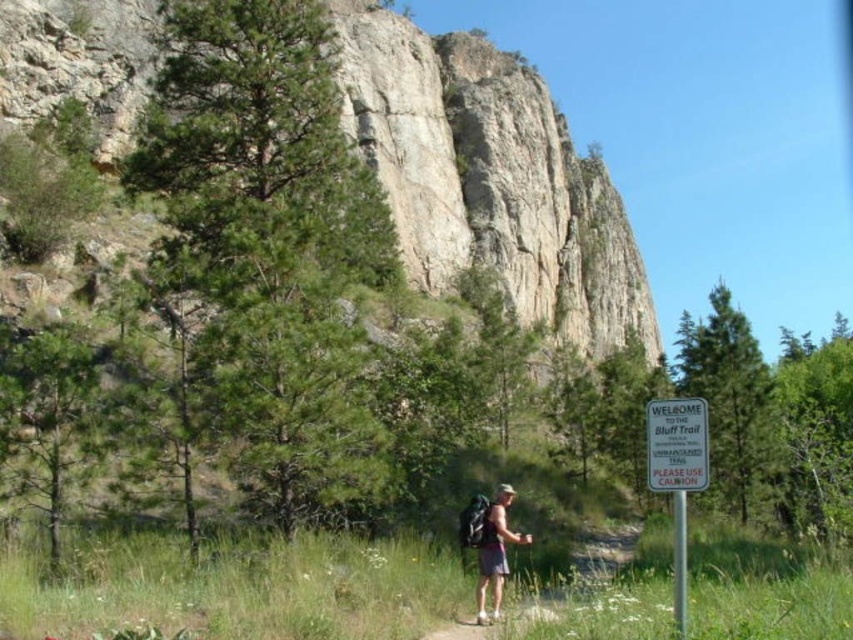
Does white plastic sign at center appear under matte gray backpack at center?

Incorrect, white plastic sign at center is not positioned below matte gray backpack at center.

Does white plastic sign at center have a larger size compared to matte gray backpack at center?

Incorrect, white plastic sign at center is not larger than matte gray backpack at center.

You are a GUI agent. You are given a task and a screenshot of the screen. Output one action in this format:
    pyautogui.click(x=<x>, y=<y>)
    Task: Click on the white plastic sign at center
    The width and height of the screenshot is (853, 640).
    Given the screenshot: What is the action you would take?
    pyautogui.click(x=677, y=444)

Is rugged stone mountain at center further to camera compared to white plastic sign at center?

Yes, rugged stone mountain at center is behind white plastic sign at center.

Is rugged stone mountain at center taller than white plastic sign at center?

Indeed, rugged stone mountain at center has a greater height compared to white plastic sign at center.

Measure the distance between point (630, 324) and camera.

The distance of point (630, 324) from camera is 162.76 meters.

Image resolution: width=853 pixels, height=640 pixels. Identify the location of rugged stone mountain at center. (490, 179).

Is the position of rugged stone mountain at center more distant than that of matte gray backpack at center?

Yes, it is behind matte gray backpack at center.

Who is shorter, rugged stone mountain at center or matte gray backpack at center?

Standing shorter between the two is matte gray backpack at center.

Is point (529, 104) closer to viewer compared to point (496, 552)?

No, it is behind (496, 552).

Find the location of a particular element. rugged stone mountain at center is located at coordinates (490, 179).